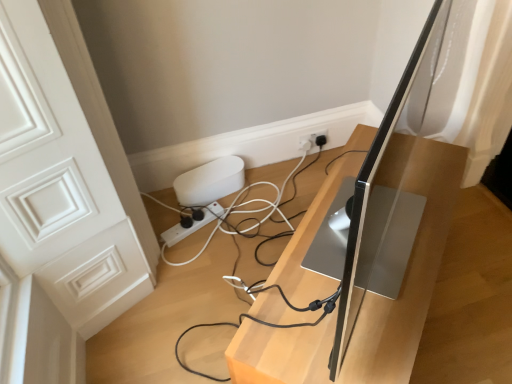
Question: From the image's perspective, is silver metallic computer monitor at center positioned above or below white plastic power strip at lower center?

Choices:
 (A) below
 (B) above

Answer: (B)

Question: In terms of width, does silver metallic computer monitor at center look wider or thinner when compared to white plastic power strip at lower center?

Choices:
 (A) thin
 (B) wide

Answer: (B)

Question: Estimate the real-world distances between objects in this image. Which object is closer to the white plastic power strip at lower center?

Choices:
 (A) silver metallic monitor at center
 (B) silver metallic computer monitor at center

Answer: (A)

Question: Estimate the real-world distances between objects in this image. Which object is farther from the white plastic power strip at lower center?

Choices:
 (A) silver metallic computer monitor at center
 (B) silver metallic monitor at center

Answer: (A)